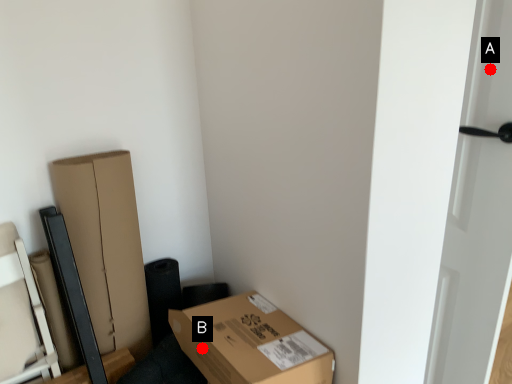
Question: Two points are circled on the image, labeled by A and B beside each circle. Which of the following is the closest to the observer?

Choices:
 (A) A is closer
 (B) B is closer

Answer: (A)